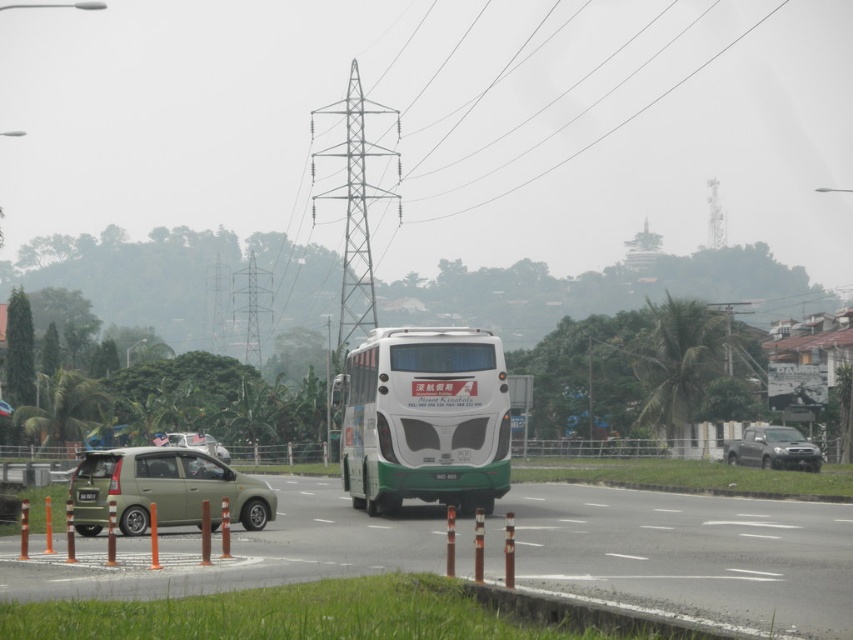
Is the position of white matte bus at center more distant than that of metallic silver car at center?

No, white matte bus at center is closer to the viewer.

Can you confirm if white matte bus at center is positioned above metallic silver car at center?

Yes, white matte bus at center is above metallic silver car at center.

What do you see at coordinates (425, 419) in the screenshot? I see `white matte bus at center` at bounding box center [425, 419].

Find the location of a particular element. white matte bus at center is located at coordinates (425, 419).

Which is below, white matte bus at center or smokey gray metallic truck at right?

smokey gray metallic truck at right is below.

Image resolution: width=853 pixels, height=640 pixels. Identify the location of white matte bus at center. (425, 419).

You are a GUI agent. You are given a task and a screenshot of the screen. Output one action in this format:
    pyautogui.click(x=<x>, y=<y>)
    Task: Click on the white matte bus at center
    Image resolution: width=853 pixels, height=640 pixels.
    Given the screenshot: What is the action you would take?
    pyautogui.click(x=425, y=419)

Who is higher up, matte green car at left or black plastic license plate at center?

black plastic license plate at center is higher up.

Is point (190, 500) closer to camera compared to point (97, 490)?

No, (190, 500) is behind (97, 490).

You are a GUI agent. You are given a task and a screenshot of the screen. Output one action in this format:
    pyautogui.click(x=<x>, y=<y>)
    Task: Click on the matte green car at left
    
    Given the screenshot: What is the action you would take?
    pyautogui.click(x=164, y=490)

Identify the location of matte green car at left. (164, 490).